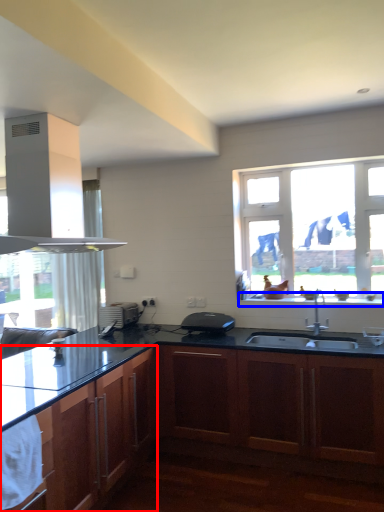
Question: Which object is closer to the camera taking this photo, cabinetry (highlighted by a red box) or window sill (highlighted by a blue box)?

Choices:
 (A) cabinetry
 (B) window sill

Answer: (A)